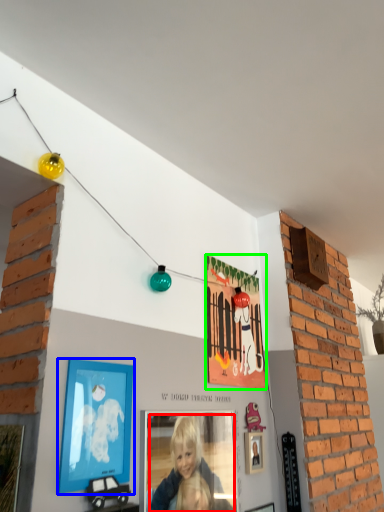
Question: Which is farther away from person (highlighted by a red box)? picture frame (highlighted by a blue box) or picture frame (highlighted by a green box)?

Choices:
 (A) picture frame
 (B) picture frame

Answer: (B)